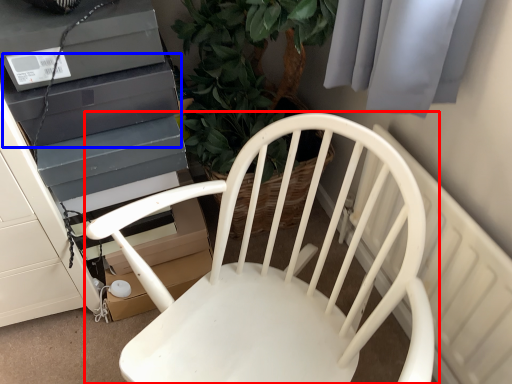
Question: Which of the following is the closest to the observer, chair (highlighted by a red box) or appliance (highlighted by a blue box)?

Choices:
 (A) chair
 (B) appliance

Answer: (A)